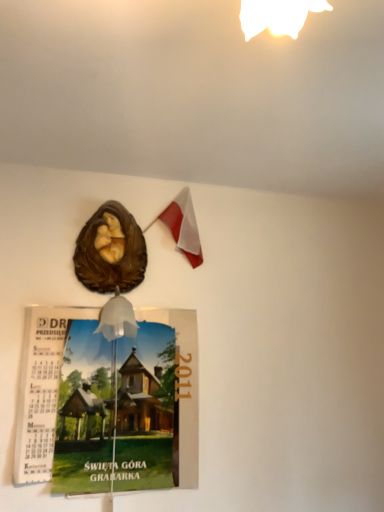
Question: Can you confirm if matte paper calendar at lower left is shorter than brown glossy sculpture at upper center?

Choices:
 (A) yes
 (B) no

Answer: (B)

Question: Is matte paper calendar at lower left taller than brown glossy sculpture at upper center?

Choices:
 (A) yes
 (B) no

Answer: (A)

Question: Would you say matte paper calendar at lower left is outside brown glossy sculpture at upper center?

Choices:
 (A) yes
 (B) no

Answer: (A)

Question: Considering the relative positions of matte paper calendar at lower left and brown glossy sculpture at upper center in the image provided, is matte paper calendar at lower left to the right of brown glossy sculpture at upper center from the viewer's perspective?

Choices:
 (A) no
 (B) yes

Answer: (B)

Question: Is matte paper calendar at lower left touching brown glossy sculpture at upper center?

Choices:
 (A) yes
 (B) no

Answer: (B)

Question: Based on their positions, is matte paper calendar at lower left located to the left or right of brown glossy sculpture at upper center?

Choices:
 (A) left
 (B) right

Answer: (B)

Question: From the image's perspective, is matte paper calendar at lower left above or below brown glossy sculpture at upper center?

Choices:
 (A) above
 (B) below

Answer: (B)

Question: In terms of width, does matte paper calendar at lower left look wider or thinner when compared to brown glossy sculpture at upper center?

Choices:
 (A) thin
 (B) wide

Answer: (A)

Question: Based on their sizes in the image, would you say matte paper calendar at lower left is bigger or smaller than brown glossy sculpture at upper center?

Choices:
 (A) small
 (B) big

Answer: (B)

Question: Is brown glossy sculpture at upper center wider or thinner than polish flag at upper center?

Choices:
 (A) thin
 (B) wide

Answer: (B)

Question: From the image's perspective, relative to polish flag at upper center, is brown glossy sculpture at upper center above or below?

Choices:
 (A) above
 (B) below

Answer: (B)

Question: Considering the positions of brown glossy sculpture at upper center and polish flag at upper center in the image, is brown glossy sculpture at upper center bigger or smaller than polish flag at upper center?

Choices:
 (A) big
 (B) small

Answer: (A)

Question: From a real-world perspective, is brown glossy sculpture at upper center above or below polish flag at upper center?

Choices:
 (A) below
 (B) above

Answer: (A)

Question: Relative to matte paper calendar at lower left, is polish flag at upper center in front or behind?

Choices:
 (A) front
 (B) behind

Answer: (B)

Question: From the image's perspective, is polish flag at upper center positioned above or below matte paper calendar at lower left?

Choices:
 (A) above
 (B) below

Answer: (A)